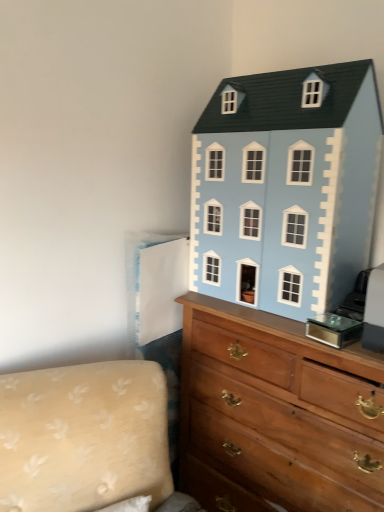
Question: Is beige fabric couch at lower left oriented away from light blue painted wood dollhouse at upper right?

Choices:
 (A) yes
 (B) no

Answer: (B)

Question: Can you confirm if beige fabric couch at lower left is positioned to the right of light blue painted wood dollhouse at upper right?

Choices:
 (A) yes
 (B) no

Answer: (B)

Question: Does beige fabric couch at lower left come in front of light blue painted wood dollhouse at upper right?

Choices:
 (A) no
 (B) yes

Answer: (B)

Question: From a real-world perspective, is beige fabric couch at lower left over light blue painted wood dollhouse at upper right?

Choices:
 (A) yes
 (B) no

Answer: (B)

Question: Is beige fabric couch at lower left not within light blue painted wood dollhouse at upper right?

Choices:
 (A) yes
 (B) no

Answer: (A)

Question: From a real-world perspective, is beige fabric couch at lower left physically below light blue painted wood dollhouse at upper right?

Choices:
 (A) no
 (B) yes

Answer: (B)

Question: Is beige fabric couch at lower left to the right of wooden chest of drawers at upper right from the viewer's perspective?

Choices:
 (A) no
 (B) yes

Answer: (A)

Question: Is beige fabric couch at lower left positioned behind wooden chest of drawers at upper right?

Choices:
 (A) no
 (B) yes

Answer: (A)

Question: Does beige fabric couch at lower left have a greater width compared to wooden chest of drawers at upper right?

Choices:
 (A) yes
 (B) no

Answer: (A)

Question: Is beige fabric couch at lower left thinner than wooden chest of drawers at upper right?

Choices:
 (A) yes
 (B) no

Answer: (B)

Question: Is beige fabric couch at lower left facing towards wooden chest of drawers at upper right?

Choices:
 (A) yes
 (B) no

Answer: (B)

Question: From the image's perspective, is beige fabric couch at lower left on top of wooden chest of drawers at upper right?

Choices:
 (A) yes
 (B) no

Answer: (B)

Question: Is light blue painted wood dollhouse at upper right behind wooden chest of drawers at upper right?

Choices:
 (A) no
 (B) yes

Answer: (B)